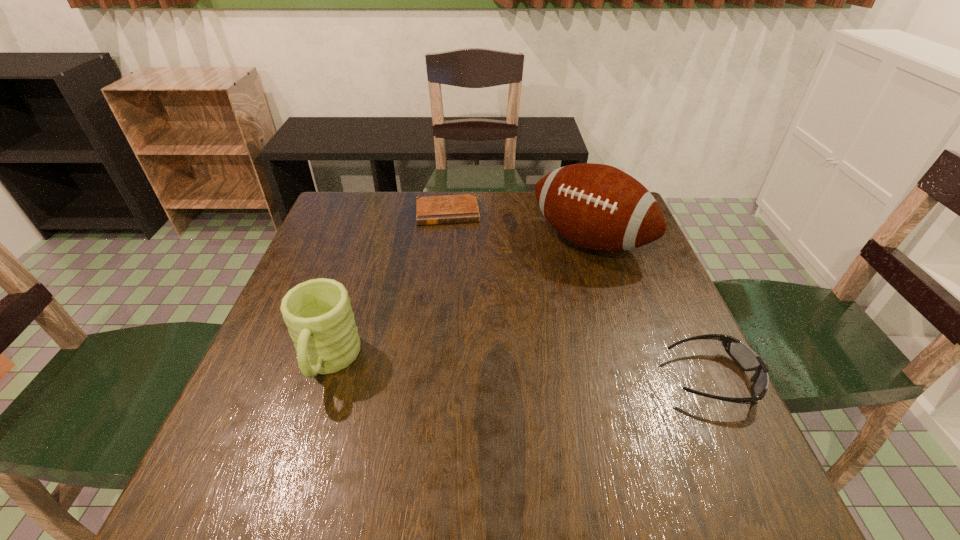
Identify the location of object situated at the near right corner. (746, 359).

In the image, there is a desktop. Where is `vacant area at the far edge`? vacant area at the far edge is located at coordinates tap(512, 204).

Identify the location of vacant space at the near edge. The height and width of the screenshot is (540, 960). (528, 418).

This screenshot has width=960, height=540. In order to click on free space at the right edge of the desktop in this screenshot , I will do `click(631, 383)`.

The image size is (960, 540). I want to click on free region at the far left corner of the desktop, so tap(326, 214).

In the image, there is a desktop. Identify the location of vacant space at the near left corner. pos(301,409).

This screenshot has height=540, width=960. I want to click on vacant space that's between the shortest object and the third tallest object, so click(x=580, y=295).

Locate an element on the screen. This screenshot has width=960, height=540. free space between the third object from right to left and the tallest object is located at coordinates (518, 227).

Image resolution: width=960 pixels, height=540 pixels. Find the location of `vacant area that lies between the tallest object and the diary`. vacant area that lies between the tallest object and the diary is located at coordinates (518, 227).

What are the coordinates of `vacant region between the third object from right to left and the sunglasses` in the screenshot? It's located at (580, 295).